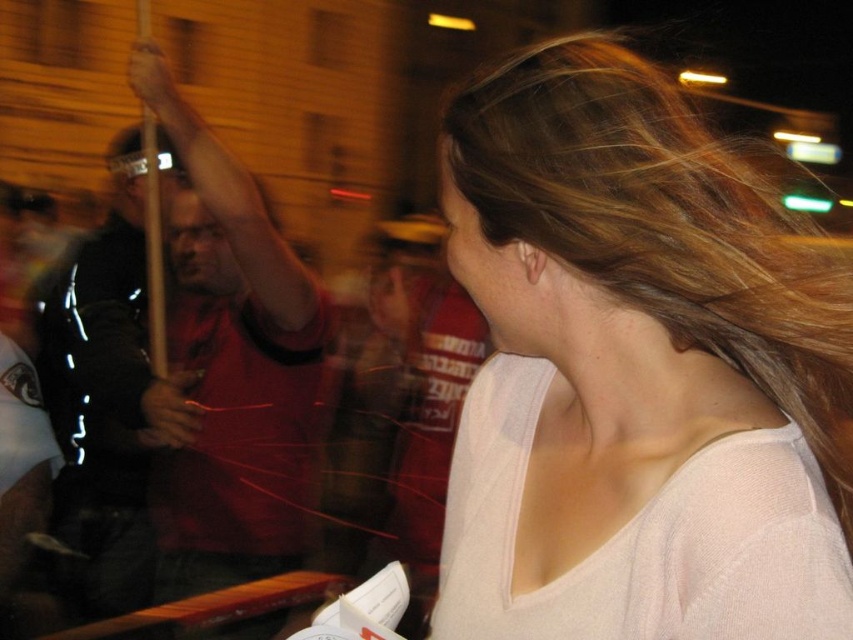
You are a photographer trying to capture a photo of the light pink sweater at center and the matte red shirt at left. You need to ensure both are in focus. Given that your camera has a depth of field that can sharply focus objects within a 1.20 meter range, will both subjects be in focus?

The light pink sweater at center and the matte red shirt at left are 1.30 meters apart. Since the distance between them exceeds the camera sensor depth of field range of 1.20 meters, both subjects cannot be in focus simultaneously.

You are standing in the crowd at this nighttime event and want to take a photo of the light pink sweater at center and the matte red shirt at left. Which object will appear larger in your photo?

The light pink sweater at center will appear larger in the photo because it is closer to the viewer than the matte red shirt at left.

You are a photographer at the event and want to capture both the light pink sweater at center and the matte red shirt at left in a single frame. Based on their heights, which object should you focus on first to ensure both are in focus?

The light pink sweater at center is shorter than the matte red shirt at left. To ensure both are in focus, focus on the taller object, the matte red shirt at left, as depth of field is typically better when focusing on closer or taller subjects in the frame.